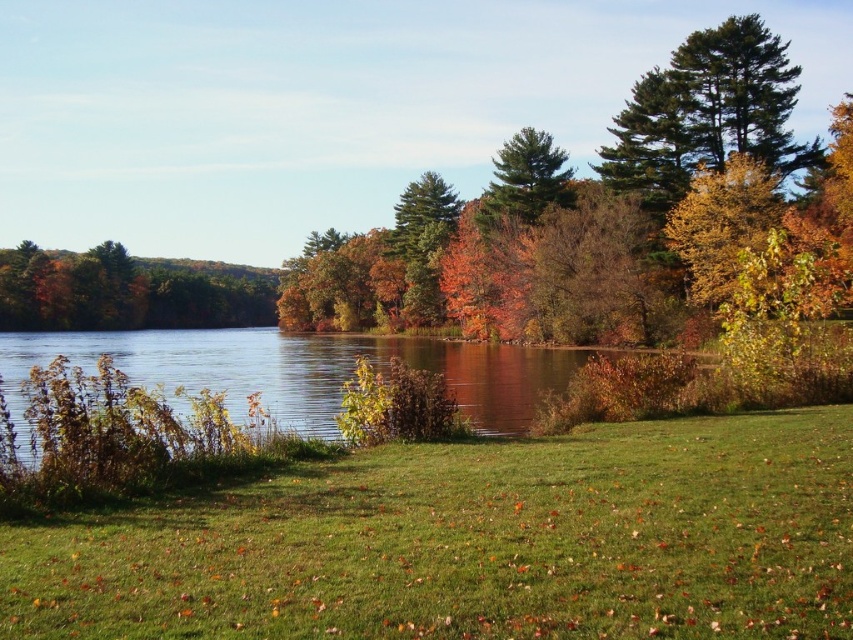
You are standing at the lakeside and want to take a photo of the green matte tree at left. If your camera has a maximum zoom range of 100 meters, will you be able to capture the entire tree in the photo without moving closer?

The green matte tree at left is 195.35 meters away from the viewer. Since the camera can only zoom up to 100 meters, you will not be able to capture the entire tree without moving closer.

You are standing at the center of the image and want to locate the green leafy tree at upper right. According to the coordinates provided, in which direction should you look to find it?

The green leafy tree at upper right is located at coordinates point (576, 214), so you should look to the upper right direction to find it.

You are standing on the lakeshore and want to take a photo of the green grassy lake at center and the green matte tree at center. Which object should you point your camera towards first if you want to capture both in a single frame?

You should point your camera towards the green matte tree at center first because it is above the green grassy lake at center, so adjusting the angle to include both would require framing from the higher object downward.